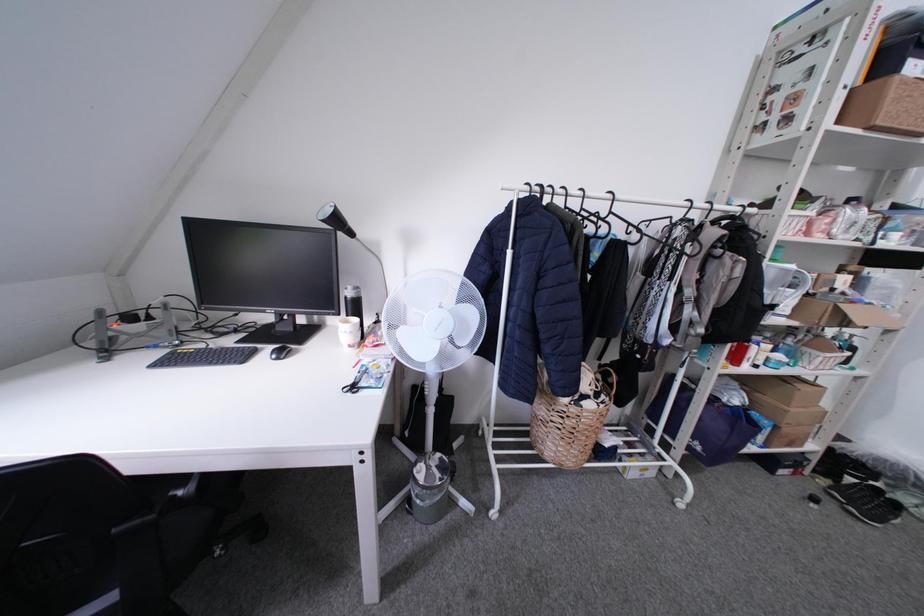
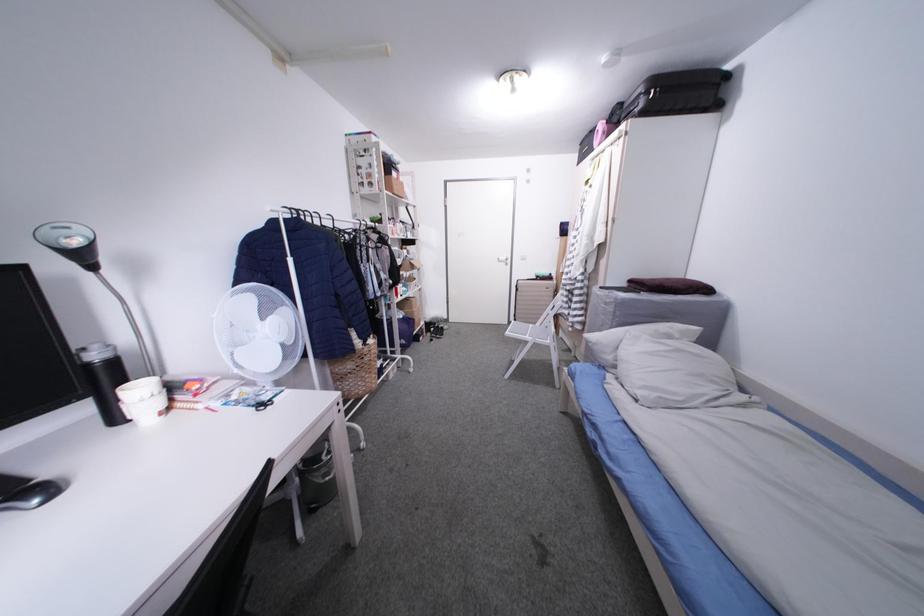
Question: The first image is from the beginning of the video and the second image is from the end. How did the camera likely rotate when shooting the video?

Choices:
 (A) Left
 (B) Right
 (C) Up
 (D) Down

Answer: (B)